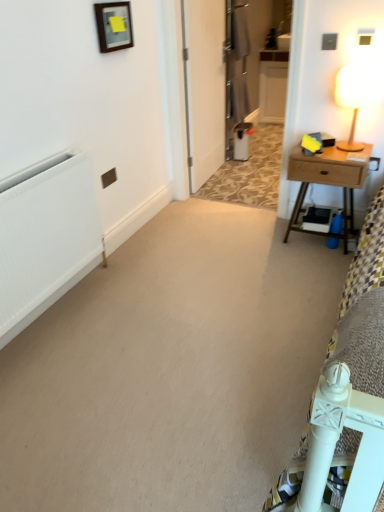
In order to click on free point in front of white matte radiator at left in this screenshot , I will do [75, 375].